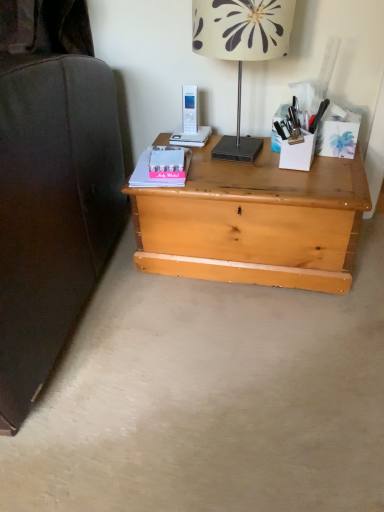
Question: From a real-world perspective, relative to white plastic phone at upper center, is light wood chest at center vertically above or below?

Choices:
 (A) above
 (B) below

Answer: (B)

Question: From the image's perspective, relative to white plastic phone at upper center, is light wood chest at center above or below?

Choices:
 (A) above
 (B) below

Answer: (B)

Question: Which object is the closest to the white plastic pen holder at upper right?

Choices:
 (A) matte pink paperback book at center, the second paperback book from the back
 (B) white plastic phone at upper center
 (C) pink matte paperback book at center, the first paperback book when ordered from back to front
 (D) light wood chest at center
 (E) white floral lampshade at upper center

Answer: (E)

Question: Based on their relative distances, which object is farther from the white floral lampshade at upper center?

Choices:
 (A) white plastic pen holder at upper right
 (B) white plastic phone at upper center
 (C) matte pink paperback book at center, which is the first paperback book in front-to-back order
 (D) pink matte paperback book at center, the first paperback book when ordered from back to front
 (E) light wood chest at center

Answer: (C)